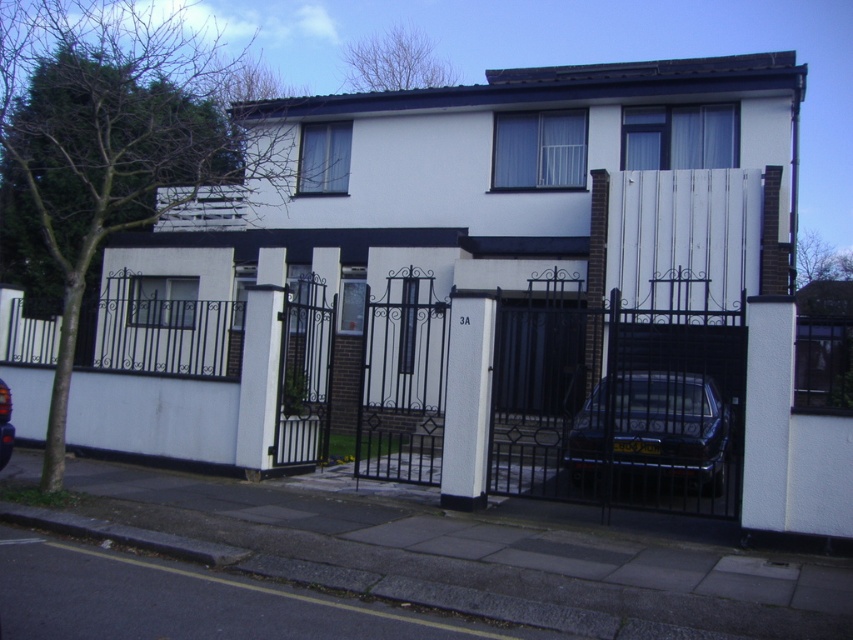
You are a delivery driver who needs to park your vehicle next to the shiny dark blue sedan at center and the shiny black car at center. Which car should you park behind to ensure your vehicle doesn,t hit the gate when backing out?

You should park behind the shiny dark blue sedan at center because it is much taller than the shiny black car at center, so there will be more clearance when backing out.

You are standing at the entrance of the driveway and want to park your car behind the shiny dark blue sedan at center. Is there enough space for your car to fit behind it?

The shiny dark blue sedan at center is located at point (653,429). Since the driveway leads to the parked car, there might be space behind it depending on the driveway length. However, without information about the driveway length or the space behind the car, it is impossible to determine if there is enough room. Please check the driveway length and space behind the car before attempting to park.